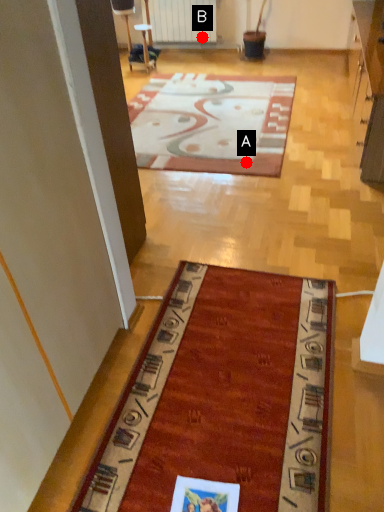
Question: Two points are circled on the image, labeled by A and B beside each circle. Which point is closer to the camera?

Choices:
 (A) A is closer
 (B) B is closer

Answer: (A)